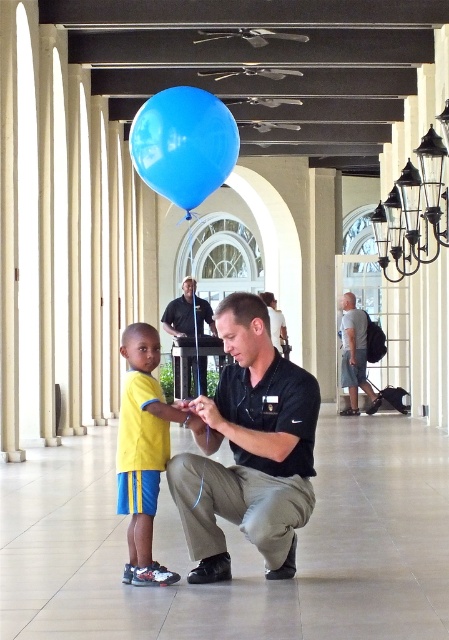
You are a security guard in the corridor. You see a blue rubber balloon at center and a black matte uniform at center. Which object is more to the right?

The blue rubber balloon at center is positioned on the right side of black matte uniform at center, so the blue rubber balloon at center is more to the right.